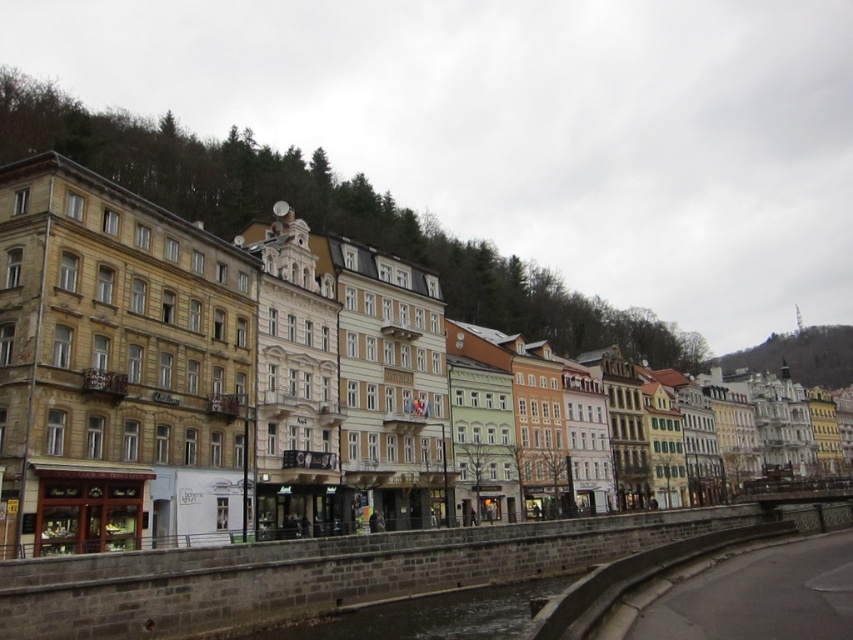
Can you confirm if beige stone buildings at center is positioned to the right of brown stone waterway at lower center?

Correct, you'll find beige stone buildings at center to the right of brown stone waterway at lower center.

Does point (322, 342) come in front of point (410, 634)?

No.

Where is `beige stone buildings at center`? beige stone buildings at center is located at coordinates (180, 378).